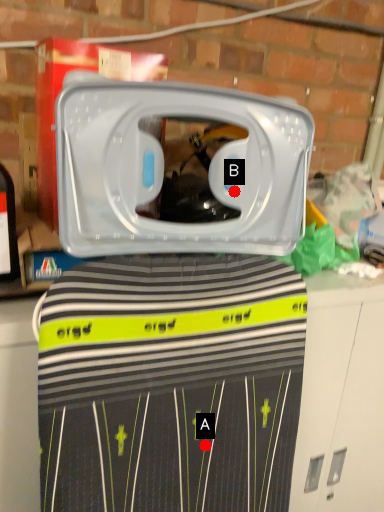
Question: Two points are circled on the image, labeled by A and B beside each circle. Which point is farther to the camera?

Choices:
 (A) A is further
 (B) B is further

Answer: (A)